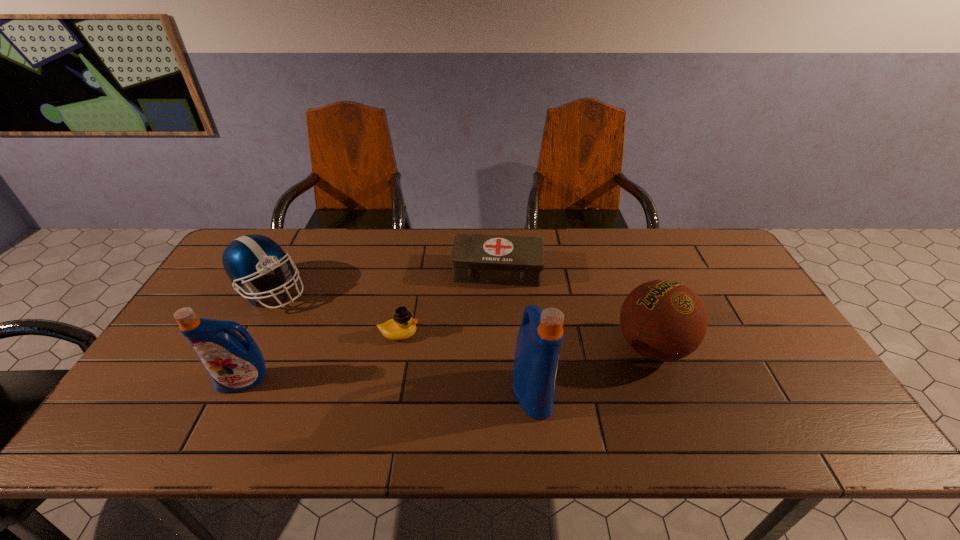
Identify the location of vacant space at the right edge of the desktop. (766, 352).

Image resolution: width=960 pixels, height=540 pixels. I want to click on vacant space at the near left corner of the desktop, so click(x=150, y=410).

In the image, there is a desktop. Identify the location of vacant space at the near right corner. (752, 380).

At what (x,y) coordinates should I click in order to perform the action: click on vacant space in between the duck and the first-aid kit. Please return your answer as a coordinate pair (x, y). This screenshot has height=540, width=960. Looking at the image, I should click on (448, 302).

Find the location of a particular element. vacant space that is in between the right detergent and the third object from left to right is located at coordinates (466, 363).

You are a GUI agent. You are given a task and a screenshot of the screen. Output one action in this format:
    pyautogui.click(x=<x>, y=<y>)
    Task: Click on the free space between the tallest object and the shorter detergent
    
    Given the screenshot: What is the action you would take?
    pyautogui.click(x=388, y=386)

Where is `free spot between the fifth shortest object and the duck`? free spot between the fifth shortest object and the duck is located at coordinates (322, 357).

At what (x,y) coordinates should I click in order to perform the action: click on free space between the rightmost object and the first-aid kit. Please return your answer as a coordinate pair (x, y). Looking at the image, I should click on (x=575, y=309).

Where is `vacant space in between the shorter detergent and the third shortest object`? This screenshot has width=960, height=540. vacant space in between the shorter detergent and the third shortest object is located at coordinates (257, 336).

Find the location of a particular element. This screenshot has width=960, height=540. vacant area that lies between the first-aid kit and the basketball is located at coordinates (575, 309).